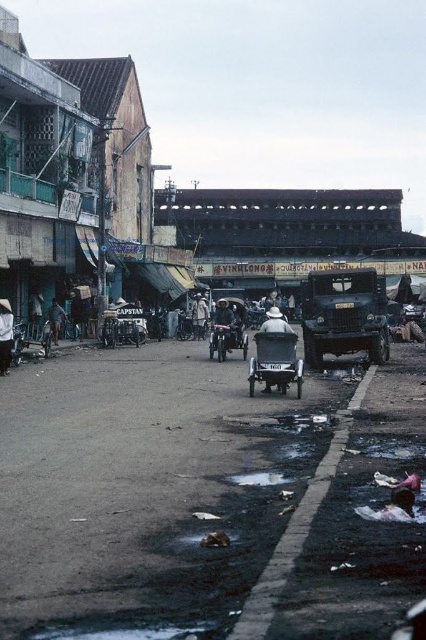
Is matte green military vehicle at center smaller than white matte tricycle at center?

A: No, matte green military vehicle at center is not smaller than white matte tricycle at center.

Who is positioned more to the left, matte green military vehicle at center or white matte tricycle at center?

white matte tricycle at center is more to the left.

Locate an element on the screen. This screenshot has height=640, width=426. matte green military vehicle at center is located at coordinates (344, 314).

Which is behind, point (230, 324) or point (287, 324)?

Point (230, 324)

In the scene shown: Which is above, dark blue fabric umbrella at center or white matte tricycle at center?

dark blue fabric umbrella at center is above.

Where is `dark blue fabric umbrella at center`? dark blue fabric umbrella at center is located at coordinates (222, 326).

Which is above, matte green military vehicle at center or light brown fabric hat at center?

matte green military vehicle at center is higher up.

Is point (357, 289) in front of point (193, 321)?

That is True.

Locate an element on the screen. Image resolution: width=426 pixels, height=640 pixels. matte green military vehicle at center is located at coordinates (344, 314).

Where is `matte green military vehicle at center`? This screenshot has height=640, width=426. matte green military vehicle at center is located at coordinates (344, 314).